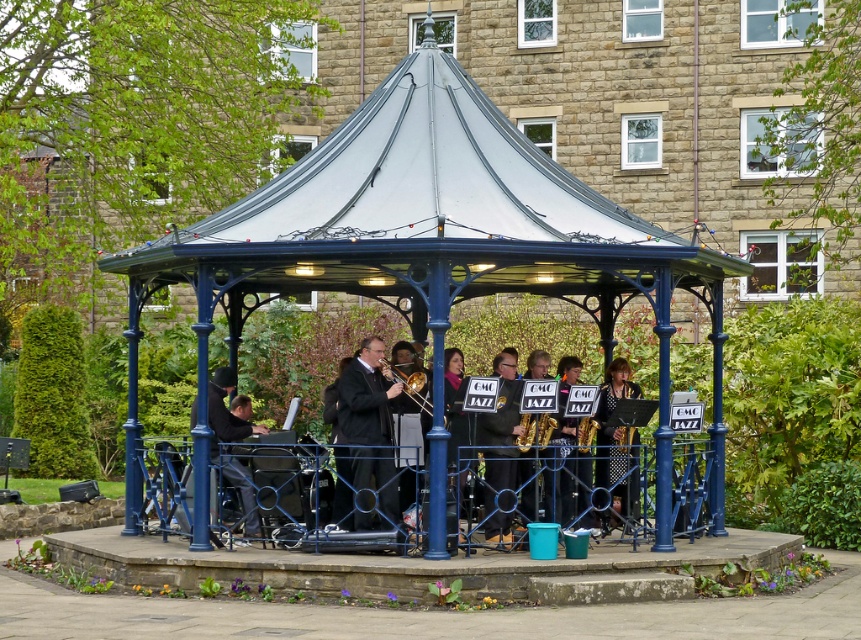
Between polka dot dress at center and gold brass trombone at center, which one has more height?

polka dot dress at center

Which is below, polka dot dress at center or gold brass trombone at center?

Positioned lower is polka dot dress at center.

Where is `polka dot dress at center`? The image size is (861, 640). polka dot dress at center is located at coordinates (617, 444).

Who is taller, shiny gold saxophone at center or satin gold saxophone at center?

With more height is shiny gold saxophone at center.

Locate an element on the screen. Image resolution: width=861 pixels, height=640 pixels. shiny gold saxophone at center is located at coordinates (574, 484).

Who is higher up, satin gold saxophone at center or gold brass trombone at center?

Positioned higher is gold brass trombone at center.

Does satin gold saxophone at center lie behind gold brass trombone at center?

That is False.

From the picture: Who is more distant from viewer, (531, 417) or (389, 365)?

Positioned behind is point (389, 365).

Locate an element on the screen. satin gold saxophone at center is located at coordinates (536, 412).